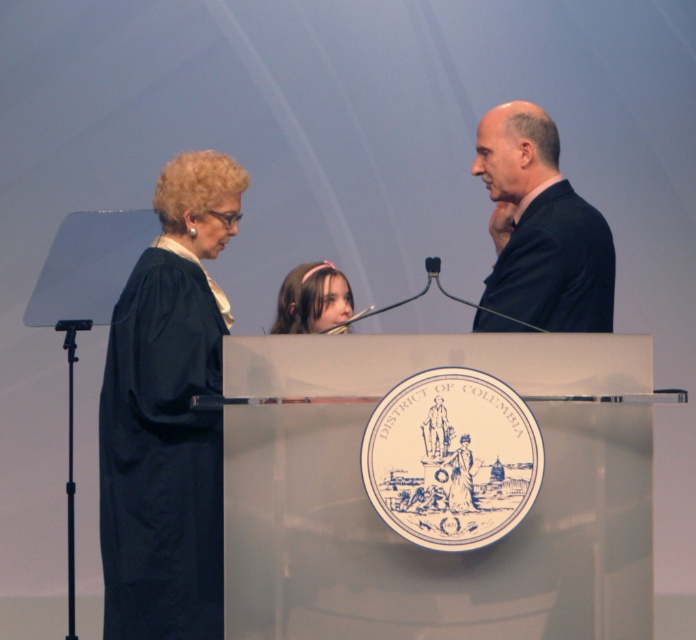
Who is higher up, dark blue suit at upper right or pink headband at center?

dark blue suit at upper right is above.

Is dark blue suit at upper right bigger than pink headband at center?

Indeed, dark blue suit at upper right has a larger size compared to pink headband at center.

Which is in front, point (574, 285) or point (290, 324)?

Positioned in front is point (574, 285).

Identify the location of dark blue suit at upper right. The height and width of the screenshot is (640, 696). (541, 227).

Does navy blue fabric robe at left have a greater height compared to dark blue suit at upper right?

Indeed, navy blue fabric robe at left has a greater height compared to dark blue suit at upper right.

The image size is (696, 640). In order to click on navy blue fabric robe at left in this screenshot , I will do `click(161, 452)`.

Is navy blue fabric robe at left thinner than pink headband at center?

No, navy blue fabric robe at left is not thinner than pink headband at center.

Which is below, navy blue fabric robe at left or pink headband at center?

navy blue fabric robe at left

Find the location of `navy blue fabric robe at left`. navy blue fabric robe at left is located at coordinates (161, 452).